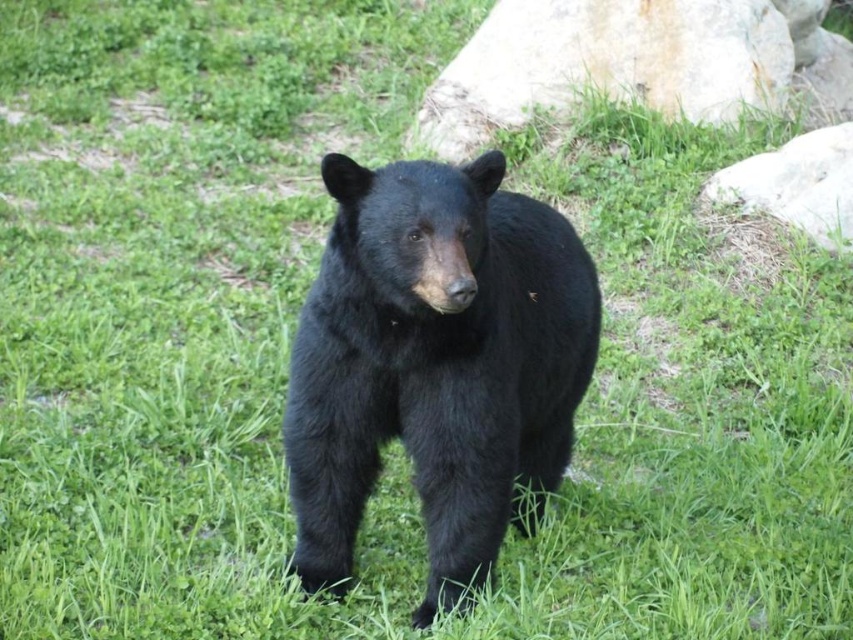
Question: From the image, what is the correct spatial relationship of black furry bear at center in relation to gray rock at upper right?

Choices:
 (A) above
 (B) below

Answer: (B)

Question: Estimate the real-world distances between objects in this image. Which object is closer to the gray rock at upper right?

Choices:
 (A) black furry bear at center
 (B) white smooth rock at right

Answer: (B)

Question: Which point is farther to the camera?

Choices:
 (A) black furry bear at center
 (B) gray rock at upper right
 (C) white smooth rock at right

Answer: (B)

Question: Does black furry bear at center appear on the right side of gray rock at upper right?

Choices:
 (A) yes
 (B) no

Answer: (B)

Question: Can you confirm if black furry bear at center is smaller than gray rock at upper right?

Choices:
 (A) no
 (B) yes

Answer: (B)

Question: Among these points, which one is nearest to the camera?

Choices:
 (A) (718, 1)
 (B) (451, 518)

Answer: (B)